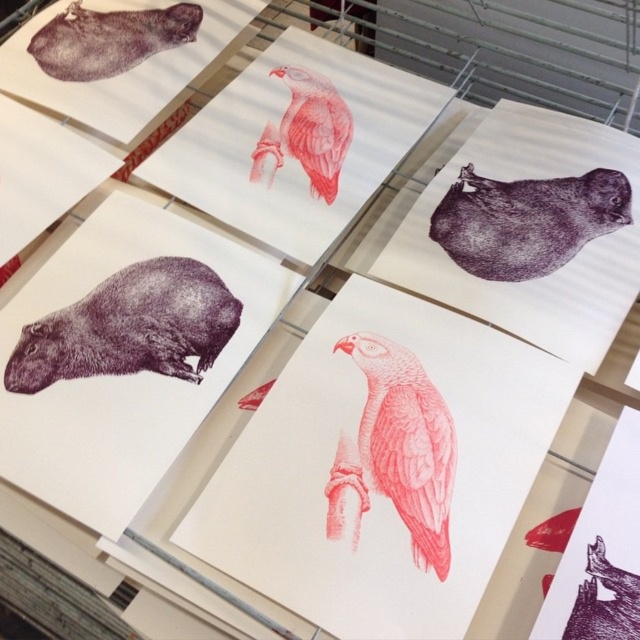
You are standing in front of the metal rack with the printed sheets. There are two points marked on the sheets, one at coordinates point (557, 227) and the other at point (35, 58). Which point is closer to you?

Point (557, 227) is in front of point (35, 58), so it is closer to you.

From the picture: You are an art student examining the arrangement of capybara illustrations on the metal rack. You notice the purple dotted capybara at lower left and the purple textured capybara at upper right. Which of these two capybara illustrations is placed higher up on the rack?

The purple textured capybara at upper right is placed higher up on the rack than the purple dotted capybara at lower left.

You are an art curator examining the printed sheets on the metal rack. You notice a specific point marked at coordinates (525, 220). Which animal illustration does this point correspond to?

The point at (525, 220) corresponds to the purple ink capybara at upper right.